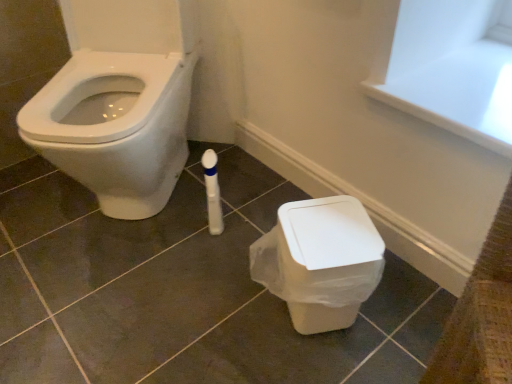
Question: Considering the relative sizes of matte white tile at center and white plastic bin at lower right in the image provided, is matte white tile at center smaller than white plastic bin at lower right?

Choices:
 (A) yes
 (B) no

Answer: (B)

Question: Is matte white tile at center at the right side of white plastic bin at lower right?

Choices:
 (A) no
 (B) yes

Answer: (A)

Question: Considering the relative sizes of matte white tile at center and white plastic bin at lower right in the image provided, is matte white tile at center taller than white plastic bin at lower right?

Choices:
 (A) yes
 (B) no

Answer: (B)

Question: From a real-world perspective, is matte white tile at center beneath white plastic bin at lower right?

Choices:
 (A) yes
 (B) no

Answer: (A)

Question: Is matte white tile at center located outside white plastic bin at lower right?

Choices:
 (A) no
 (B) yes

Answer: (B)

Question: From the image's perspective, is white plastic bin at lower right above or below matte white tile at center?

Choices:
 (A) below
 (B) above

Answer: (A)

Question: Considering the positions of white plastic bin at lower right and matte white tile at center in the image, is white plastic bin at lower right taller or shorter than matte white tile at center?

Choices:
 (A) short
 (B) tall

Answer: (B)

Question: From a real-world perspective, relative to matte white tile at center, is white plastic bin at lower right vertically above or below?

Choices:
 (A) below
 (B) above

Answer: (B)

Question: Is white plastic bin at lower right in front of or behind matte white tile at center in the image?

Choices:
 (A) front
 (B) behind

Answer: (B)

Question: From the image's perspective, is matte white tile at center located above or below white glossy bidet at left?

Choices:
 (A) above
 (B) below

Answer: (B)

Question: Do you think matte white tile at center is within white glossy bidet at left, or outside of it?

Choices:
 (A) inside
 (B) outside

Answer: (B)

Question: Considering the relative positions of matte white tile at center and white glossy bidet at left in the image provided, is matte white tile at center to the left or to the right of white glossy bidet at left?

Choices:
 (A) right
 (B) left

Answer: (A)

Question: Looking at the image, does matte white tile at center seem bigger or smaller compared to white glossy bidet at left?

Choices:
 (A) small
 (B) big

Answer: (A)

Question: Is point (173, 56) positioned closer to the camera than point (314, 294)?

Choices:
 (A) closer
 (B) farther

Answer: (B)

Question: Is white glossy bidet at left inside the boundaries of white plastic bin at lower right, or outside?

Choices:
 (A) outside
 (B) inside

Answer: (A)